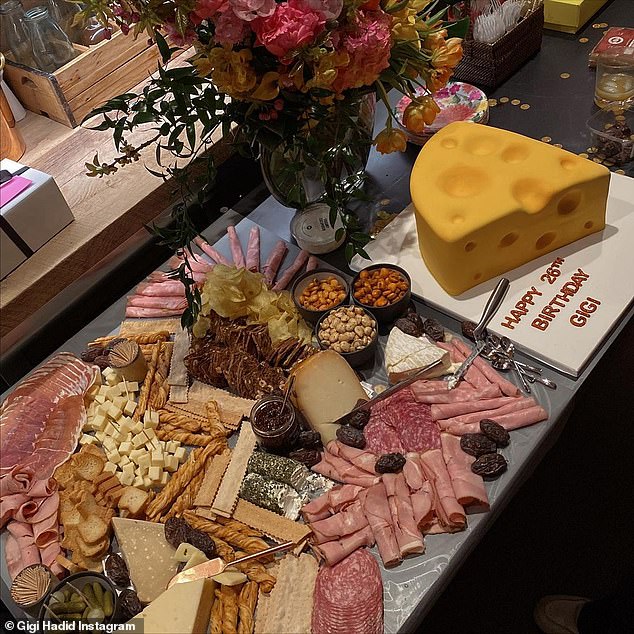
The height and width of the screenshot is (634, 634). What are the coordinates of `wooden table` in the screenshot? It's located at (123, 196).